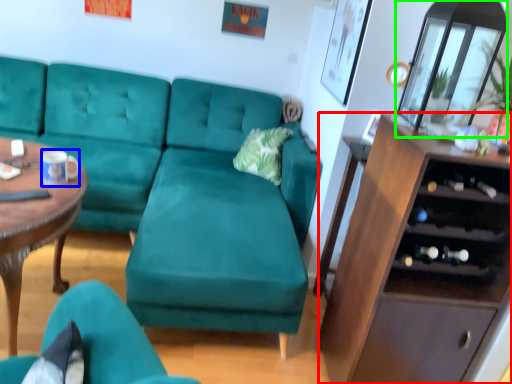
Question: Which is nearer to the cabinetry (highlighted by a red box)? coffee cup (highlighted by a blue box) or glass door (highlighted by a green box).

Choices:
 (A) coffee cup
 (B) glass door

Answer: (B)